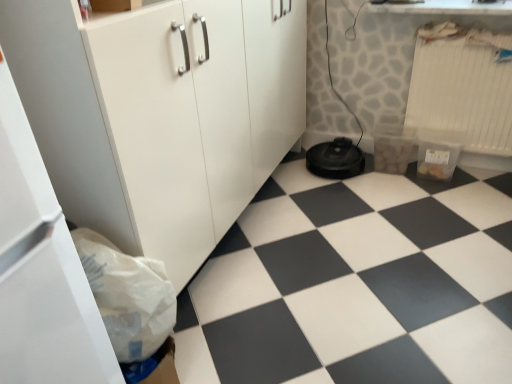
Where is `white glossy countertop at upper center`? This screenshot has width=512, height=384. white glossy countertop at upper center is located at coordinates (446, 7).

Describe the element at coordinates (463, 86) in the screenshot. I see `white plastic radiator at upper right` at that location.

In order to face white plastic radiator at upper right, should I rotate leftwards or rightwards?

You should look right and rotate roughly 26.516 degrees.

Identify the location of black rubber vacuum cleaner at lower center. The image size is (512, 384). (357, 283).

What are the coordinates of `black plastic robot vacuum cleaner at lower center` in the screenshot? It's located at (335, 159).

Image resolution: width=512 pixels, height=384 pixels. What do you see at coordinates (128, 296) in the screenshot?
I see `white paper bag at lower left` at bounding box center [128, 296].

Describe the element at coordinates (160, 113) in the screenshot. The image size is (512, 384). I see `white matte cabinet at lower left` at that location.

The image size is (512, 384). What are the coordinates of `white matte cabinet at lower left` in the screenshot? It's located at (160, 113).

Identify the location of white glossy countertop at upper center. This screenshot has width=512, height=384. (446, 7).

How many degrees apart are the facing directions of white matte cabinet at lower left and white plastic radiator at upper right?

The angular difference between white matte cabinet at lower left and white plastic radiator at upper right is 87.4 degrees.

Is white matte cabinet at lower left far from white plastic radiator at upper right?

Yes, white matte cabinet at lower left and white plastic radiator at upper right are quite far apart.

Is white plastic radiator at upper right at the back of white matte cabinet at lower left?

No, white matte cabinet at lower left is not facing the opposite direction of white plastic radiator at upper right.

Is white matte cabinet at lower left inside the boundaries of white plastic radiator at upper right, or outside?

white matte cabinet at lower left is spatially situated outside white plastic radiator at upper right.

The image size is (512, 384). What are the coordinates of `radiator that is above the black plastic robot vacuum cleaner at lower center (from a real-world perspective)` in the screenshot? It's located at [463, 86].

Which is more to the left, black plastic robot vacuum cleaner at lower center or white plastic radiator at upper right?

black plastic robot vacuum cleaner at lower center.

Can you confirm if black plastic robot vacuum cleaner at lower center is wider than white plastic radiator at upper right?

Indeed, black plastic robot vacuum cleaner at lower center has a greater width compared to white plastic radiator at upper right.

From a real-world perspective, is black plastic robot vacuum cleaner at lower center under white plastic radiator at upper right?

Correct, in the physical world, black plastic robot vacuum cleaner at lower center is lower than white plastic radiator at upper right.

In the image, is black plastic robot vacuum cleaner at lower center positioned in front of or behind black rubber vacuum cleaner at lower center?

black plastic robot vacuum cleaner at lower center is positioned farther from the viewer than black rubber vacuum cleaner at lower center.

From a real-world perspective, relative to black rubber vacuum cleaner at lower center, is black plastic robot vacuum cleaner at lower center vertically above or below?

black plastic robot vacuum cleaner at lower center is situated higher than black rubber vacuum cleaner at lower center in the real world.

Is black plastic robot vacuum cleaner at lower center bigger than black rubber vacuum cleaner at lower center?

Incorrect, black plastic robot vacuum cleaner at lower center is not larger than black rubber vacuum cleaner at lower center.

Looking at the image, does white matte cabinet at lower left seem bigger or smaller compared to white paper bag at lower left?

Considering their sizes, white matte cabinet at lower left takes up more space than white paper bag at lower left.

Is point (266, 177) farther from viewer compared to point (96, 299)?

Yes.

Based on the photo, how much distance is there between white matte cabinet at lower left and white paper bag at lower left?

14.42 inches.

Considering the sizes of objects white matte cabinet at lower left and white paper bag at lower left in the image provided, who is wider, white matte cabinet at lower left or white paper bag at lower left?

Wider between the two is white matte cabinet at lower left.

From a real-world perspective, between black rubber vacuum cleaner at lower center and black plastic robot vacuum cleaner at lower center, who is vertically higher?

From a 3D spatial view, black plastic robot vacuum cleaner at lower center is above.

From the image's perspective, relative to black plastic robot vacuum cleaner at lower center, is black rubber vacuum cleaner at lower center above or below?

black rubber vacuum cleaner at lower center is below black plastic robot vacuum cleaner at lower center.

Between black rubber vacuum cleaner at lower center and black plastic robot vacuum cleaner at lower center, which one has larger width?

Wider between the two is black rubber vacuum cleaner at lower center.

Who is shorter, black rubber vacuum cleaner at lower center or black plastic robot vacuum cleaner at lower center?

black rubber vacuum cleaner at lower center.

Considering the relative positions of white plastic radiator at upper right and white glossy countertop at upper center in the image provided, is white plastic radiator at upper right to the left of white glossy countertop at upper center from the viewer's perspective?

Incorrect, white plastic radiator at upper right is not on the left side of white glossy countertop at upper center.

Which point is more forward, (509, 142) or (422, 5)?

The point (422, 5) is closer to the camera.

From the image's perspective, is white plastic radiator at upper right under white glossy countertop at upper center?

Yes, from the image's perspective, white plastic radiator at upper right is beneath white glossy countertop at upper center.

From a real-world perspective, is white plastic radiator at upper right over white glossy countertop at upper center?

No, from a real-world perspective, white plastic radiator at upper right is not on top of white glossy countertop at upper center.

From the picture: In the image, is white paper bag at lower left positioned in front of or behind black rubber vacuum cleaner at lower center?

In the image, white paper bag at lower left appears in front of black rubber vacuum cleaner at lower center.

From the image's perspective, does white paper bag at lower left appear higher than black rubber vacuum cleaner at lower center?

No, from the image's perspective, white paper bag at lower left is not over black rubber vacuum cleaner at lower center.

Is white paper bag at lower left shorter than black rubber vacuum cleaner at lower center?

No, white paper bag at lower left is not shorter than black rubber vacuum cleaner at lower center.

Considering the positions of point (150, 326) and point (367, 220), is point (150, 326) closer or farther from the camera than point (367, 220)?

Point (150, 326) appears to be closer to the viewer than point (367, 220).

Where is `cabinetry above the white plastic radiator at upper right (from a real-world perspective)`? cabinetry above the white plastic radiator at upper right (from a real-world perspective) is located at coordinates (160, 113).

The height and width of the screenshot is (384, 512). I want to click on water heater on the left of white plastic radiator at upper right, so click(335, 159).

Considering their positions, is white glossy countertop at upper center positioned further to white matte cabinet at lower left than black plastic robot vacuum cleaner at lower center?

white glossy countertop at upper center lies further to white matte cabinet at lower left than the other object.

Considering their positions, is black plastic robot vacuum cleaner at lower center positioned further to white matte cabinet at lower left than white paper bag at lower left?

Based on the image, black plastic robot vacuum cleaner at lower center appears to be further to white matte cabinet at lower left.

Looking at the image, which one is located closer to white matte cabinet at lower left, white paper bag at lower left or black rubber vacuum cleaner at lower center?

Based on the image, white paper bag at lower left appears to be nearer to white matte cabinet at lower left.

Estimate the real-world distances between objects in this image. Which object is closer to black plastic robot vacuum cleaner at lower center, black rubber vacuum cleaner at lower center or white glossy countertop at upper center?

Among the two, black rubber vacuum cleaner at lower center is located nearer to black plastic robot vacuum cleaner at lower center.

Looking at the image, which one is located further to black plastic robot vacuum cleaner at lower center, white paper bag at lower left or white plastic radiator at upper right?

Among the two, white paper bag at lower left is located further to black plastic robot vacuum cleaner at lower center.

Looking at the image, which one is located further to white matte cabinet at lower left, white plastic radiator at upper right or black plastic robot vacuum cleaner at lower center?

white plastic radiator at upper right is further to white matte cabinet at lower left.

When comparing their distances from black plastic robot vacuum cleaner at lower center, does white plastic radiator at upper right or white paper bag at lower left seem further?

white paper bag at lower left.

When comparing their distances from white glossy countertop at upper center, does white matte cabinet at lower left or black plastic robot vacuum cleaner at lower center seem closer?

The object closer to white glossy countertop at upper center is black plastic robot vacuum cleaner at lower center.

Identify the location of counter top located between black rubber vacuum cleaner at lower center and black plastic robot vacuum cleaner at lower center in the depth direction. This screenshot has width=512, height=384. (446, 7).

The height and width of the screenshot is (384, 512). Find the location of `counter top between white paper bag at lower left and black plastic robot vacuum cleaner at lower center in the front-back direction`. counter top between white paper bag at lower left and black plastic robot vacuum cleaner at lower center in the front-back direction is located at coordinates (446, 7).

Locate an element on the screen. Image resolution: width=512 pixels, height=384 pixels. plain located between white paper bag at lower left and black plastic robot vacuum cleaner at lower center in the depth direction is located at coordinates (357, 283).

Where is `plain between white matte cabinet at lower left and black plastic robot vacuum cleaner at lower center from front to back`? This screenshot has height=384, width=512. plain between white matte cabinet at lower left and black plastic robot vacuum cleaner at lower center from front to back is located at coordinates (357, 283).